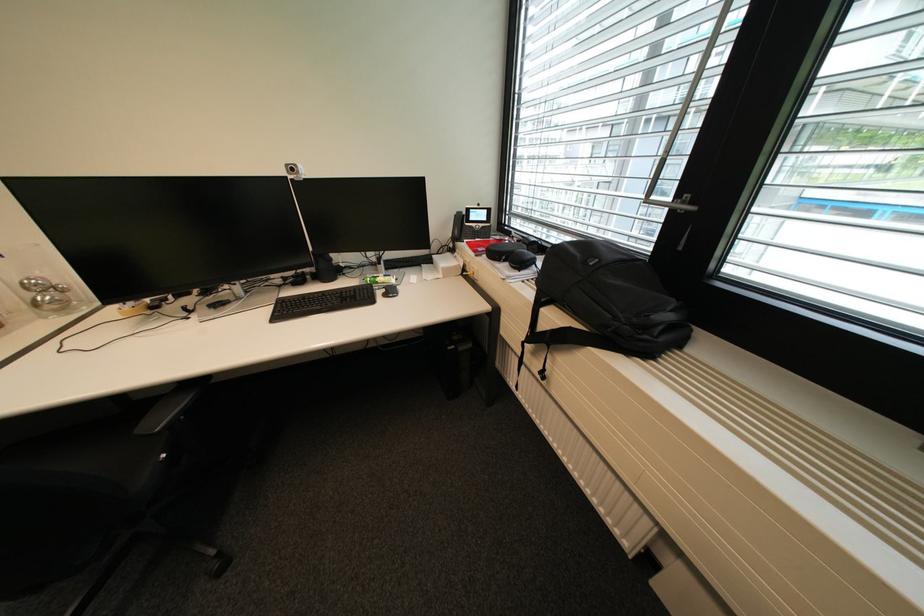
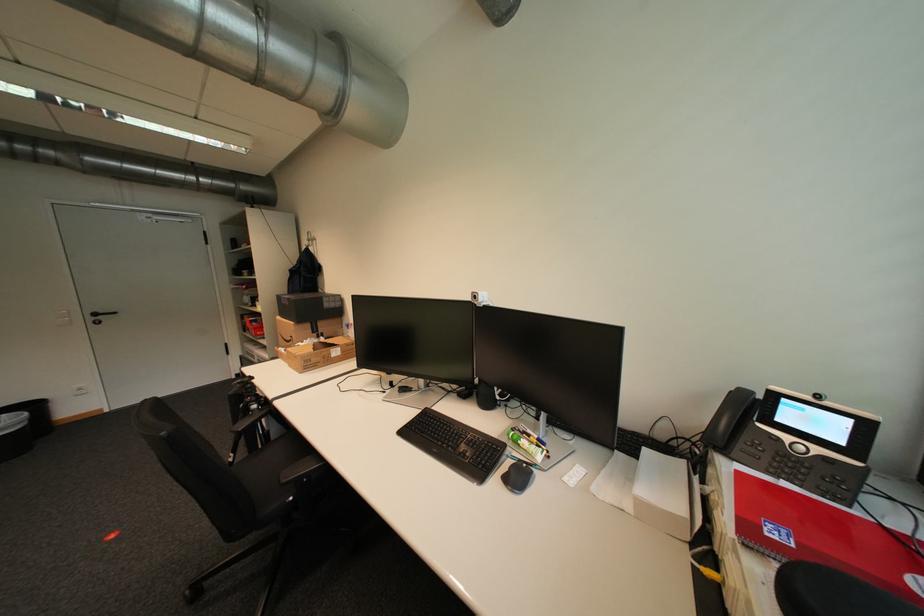
Question: How did the camera likely rotate?

Choices:
 (A) Left
 (B) Right
 (C) Up
 (D) Down

Answer: (A)